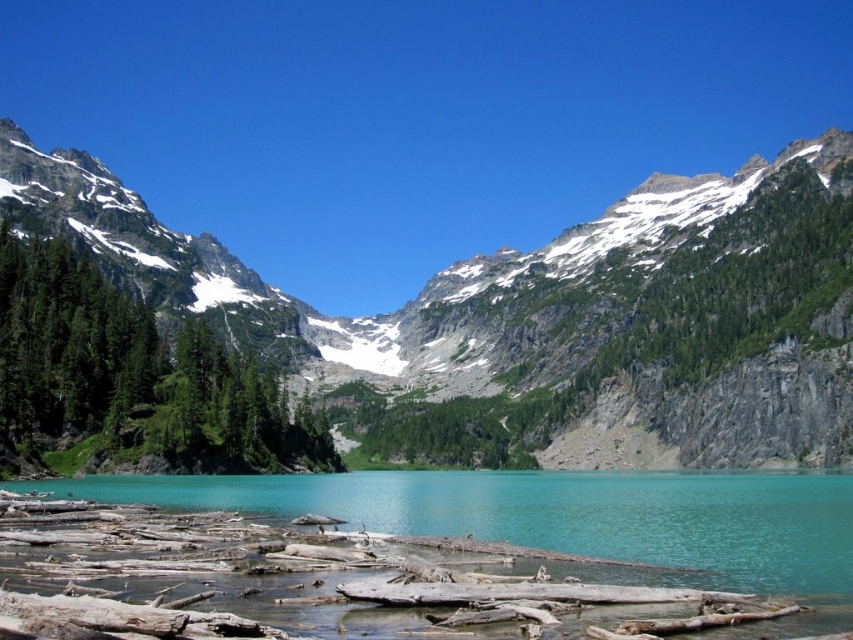
Does snowy granite mountain at center have a larger size compared to green matte tree at left?

Yes, snowy granite mountain at center is bigger than green matte tree at left.

Between point (225, 268) and point (223, 433), which one is positioned in front?

Point (223, 433)

The width and height of the screenshot is (853, 640). What are the coordinates of `snowy granite mountain at center` in the screenshot? It's located at (548, 316).

Does snowy granite mountain at center have a lesser width compared to turquoise glassy water at center?

Incorrect, snowy granite mountain at center's width is not less than turquoise glassy water at center's.

Between snowy granite mountain at center and turquoise glassy water at center, which one has less height?

With less height is turquoise glassy water at center.

Which is behind, point (213, 257) or point (798, 560)?

Point (213, 257)

This screenshot has width=853, height=640. I want to click on snowy granite mountain at center, so click(x=548, y=316).

Is turquoise glassy water at center taller than green matte tree at left?

Incorrect, turquoise glassy water at center's height is not larger of green matte tree at left's.

Looking at this image, measure the distance between turquoise glassy water at center and camera.

A distance of 273.43 feet exists between turquoise glassy water at center and camera.

Who is more distant from viewer, (567, 513) or (288, 442)?

Point (288, 442)

The height and width of the screenshot is (640, 853). Identify the location of turquoise glassy water at center. (567, 515).